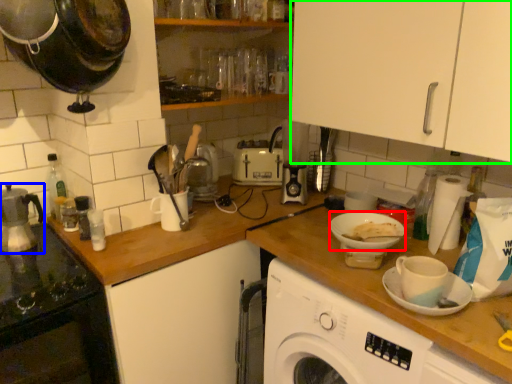
Question: Estimate the real-world distances between objects in this image. Which object is closer to tableware (highlighted by a red box), kitchen appliance (highlighted by a blue box) or cabinetry (highlighted by a green box)?

Choices:
 (A) kitchen appliance
 (B) cabinetry

Answer: (B)